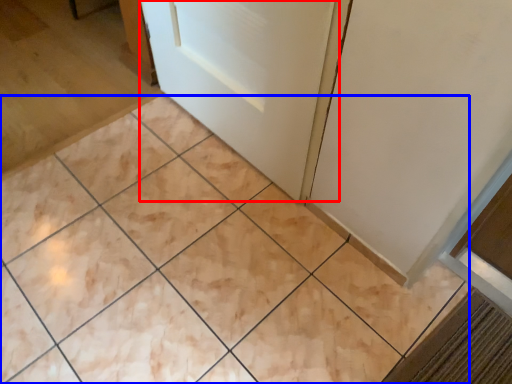
Question: Among these objects, which one is nearest to the camera, door (highlighted by a red box) or ceramic tile (highlighted by a blue box)?

Choices:
 (A) door
 (B) ceramic tile

Answer: (B)